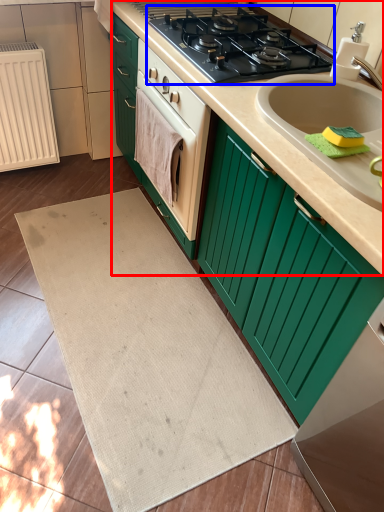
Question: Which point is closer to the camera, counter top (highlighted by a red box) or gas stove (highlighted by a blue box)?

Choices:
 (A) counter top
 (B) gas stove

Answer: (A)